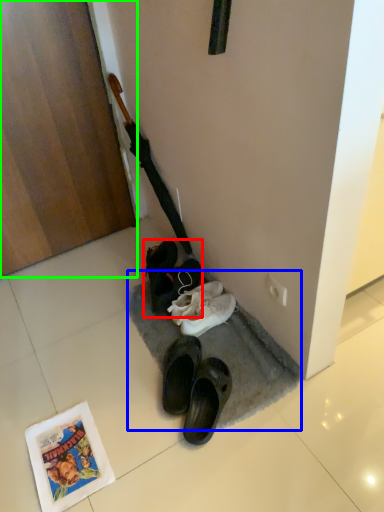
Question: Which object is positioned farthest from footwear (highlighted by a red box)? Select from doormat (highlighted by a blue box) and door (highlighted by a green box).

Choices:
 (A) doormat
 (B) door

Answer: (B)